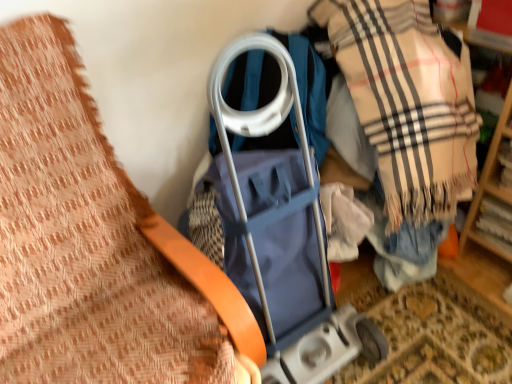
Question: Is blue fabric baby carriage at center shorter than beige plaid scarf at center right?

Choices:
 (A) no
 (B) yes

Answer: (B)

Question: From a real-world perspective, is blue fabric baby carriage at center over beige plaid scarf at center right?

Choices:
 (A) yes
 (B) no

Answer: (B)

Question: Does blue fabric baby carriage at center have a greater height compared to beige plaid scarf at center right?

Choices:
 (A) no
 (B) yes

Answer: (A)

Question: Is blue fabric baby carriage at center to the right of beige plaid scarf at center right from the viewer's perspective?

Choices:
 (A) no
 (B) yes

Answer: (A)

Question: From the image's perspective, would you say blue fabric baby carriage at center is positioned over beige plaid scarf at center right?

Choices:
 (A) no
 (B) yes

Answer: (A)

Question: Is blue fabric baby carriage at center next to beige plaid scarf at center right and touching it?

Choices:
 (A) no
 (B) yes

Answer: (A)

Question: Does beige plaid scarf at center right turn towards blue fabric baby carriage at center?

Choices:
 (A) no
 (B) yes

Answer: (B)

Question: Does beige plaid scarf at center right have a lesser height compared to blue fabric baby carriage at center?

Choices:
 (A) yes
 (B) no

Answer: (B)

Question: Is beige plaid scarf at center right positioned far away from blue fabric baby carriage at center?

Choices:
 (A) yes
 (B) no

Answer: (B)

Question: From a real-world perspective, is beige plaid scarf at center right below blue fabric baby carriage at center?

Choices:
 (A) yes
 (B) no

Answer: (B)

Question: Can you confirm if beige plaid scarf at center right is positioned to the right of blue fabric baby carriage at center?

Choices:
 (A) yes
 (B) no

Answer: (A)

Question: From the image's perspective, does beige plaid scarf at center right appear higher than blue fabric baby carriage at center?

Choices:
 (A) no
 (B) yes

Answer: (B)

Question: Is blue fabric baby carriage at center facing towards orange leather belt at upper left?

Choices:
 (A) no
 (B) yes

Answer: (A)